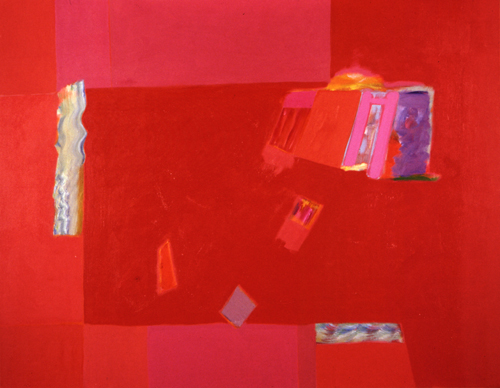
Identify the location of painting. (309, 306).